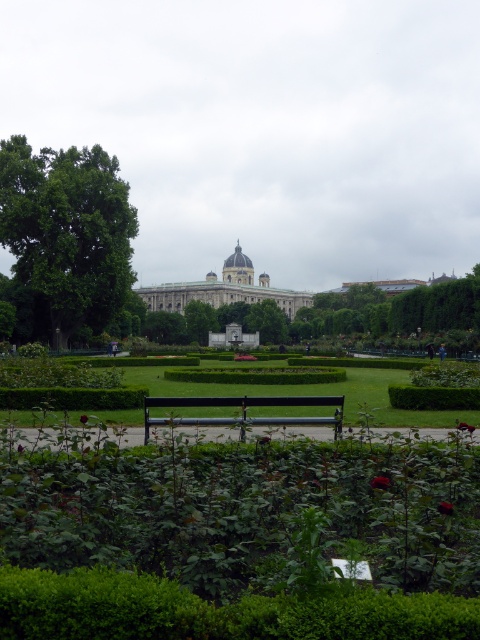
Which is above, green matte bench at center or black metal bench at center?

black metal bench at center is above.

The width and height of the screenshot is (480, 640). Describe the element at coordinates (237, 532) in the screenshot. I see `green matte bench at center` at that location.

Find the location of a particular element. This screenshot has width=480, height=640. green matte bench at center is located at coordinates (237, 532).

Measure the distance between green matte bench at center and camera.

green matte bench at center is 23.66 meters away from camera.

Does green matte bench at center have a larger size compared to white stone building at center?

Incorrect, green matte bench at center is not larger than white stone building at center.

Is point (247, 579) less distant than point (196, 296)?

Yes, point (247, 579) is closer to viewer.

In order to click on green matte bench at center in this screenshot , I will do `click(237, 532)`.

I want to click on green leafy tree at left, so click(x=67, y=243).

Does point (40, 317) lie behind point (325, 374)?

Yes, it is behind point (325, 374).

This screenshot has width=480, height=640. I want to click on green leafy tree at left, so coord(67,243).